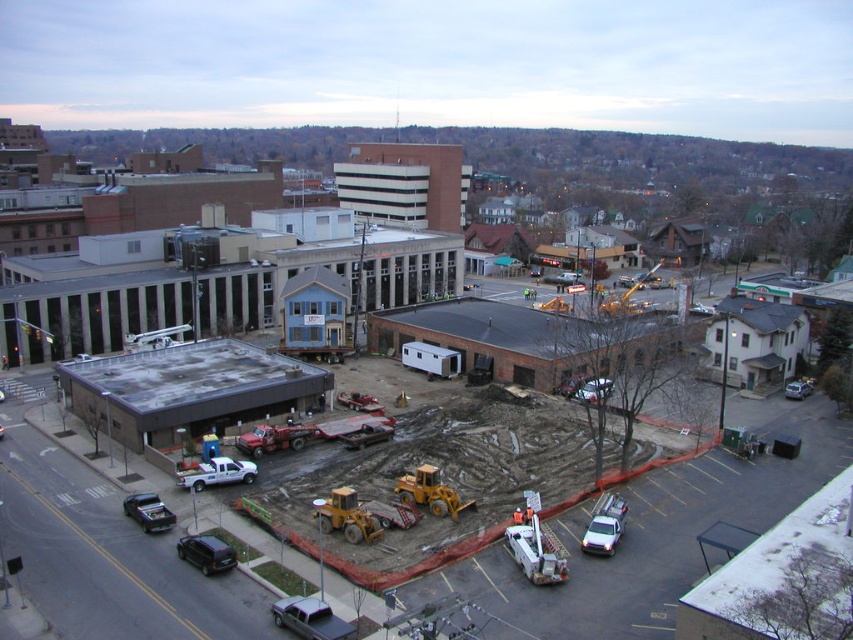
Between point (227, 547) and point (793, 394), which one is positioned in front?

Point (227, 547) is more forward.

Consider the image. Who is lower down, shiny black sedan at lower left or metallic silver sedan at center?

Positioned lower is shiny black sedan at lower left.

Which is in front, point (206, 560) or point (798, 387)?

Point (206, 560) is in front.

In order to click on shiny black sedan at lower left in this screenshot , I will do `click(206, 554)`.